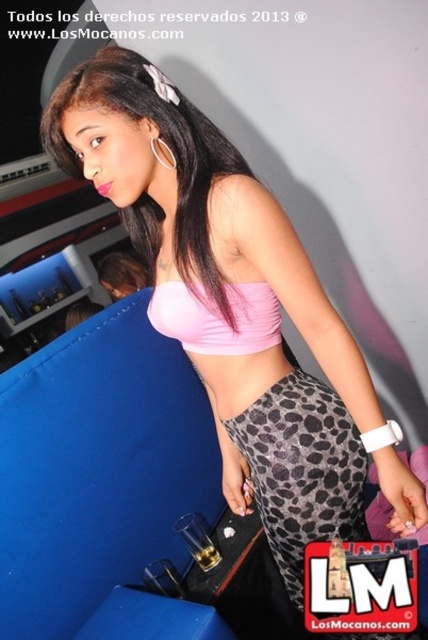
Question: Can you confirm if leopard print leggings at lower center is positioned above pink matte bikini top at center?

Choices:
 (A) no
 (B) yes

Answer: (A)

Question: Which point is farther to the camera?

Choices:
 (A) tap(279, 406)
 (B) tap(237, 330)

Answer: (A)

Question: Is leopard print leggings at lower center below pink matte bikini top at center?

Choices:
 (A) no
 (B) yes

Answer: (B)

Question: Which point is closer to the camera taking this photo?

Choices:
 (A) (184, 344)
 (B) (282, 499)

Answer: (B)

Question: Can you confirm if leopard print leggings at lower center is smaller than pink matte bikini top at center?

Choices:
 (A) no
 (B) yes

Answer: (A)